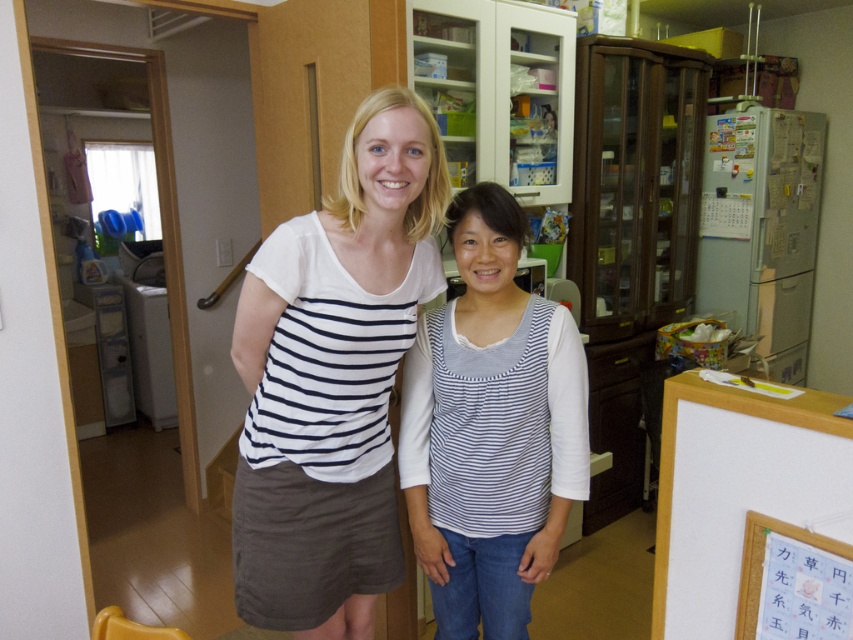
You are a delivery robot with a 10 inch wide package. You need to pass between the white cotton shirt at center and the white striped tank top at center to reach the delivery point. Can you fit through the space between them?

The distance between the white cotton shirt at center and the white striped tank top at center is 8.57 inches. Since your package is 10 inches wide, it is wider than the available space. You cannot fit through the space between them.

You are a fashion designer observing two white tops in the image. The white cotton shirt at center and the white striped tank top at center. Which one is positioned to the left?

The white cotton shirt at center is positioned to the left of the white striped tank top at center.